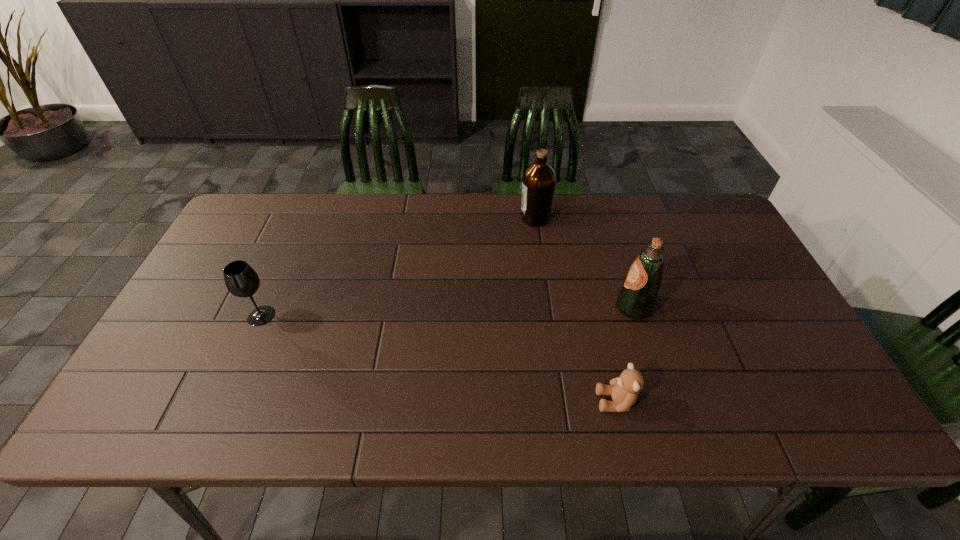
Locate an element on the screen. free space at the far edge of the desktop is located at coordinates (377, 207).

What are the coordinates of `free spot at the near edge of the desktop` in the screenshot? It's located at (711, 406).

I want to click on free region at the right edge of the desktop, so click(x=708, y=269).

Where is `vacant space at the far left corner of the desktop`? vacant space at the far left corner of the desktop is located at coordinates (275, 210).

Locate an element on the screen. The width and height of the screenshot is (960, 540). free region at the near left corner of the desktop is located at coordinates (154, 424).

In the image, there is a desktop. In order to click on free space at the far right corner in this screenshot , I will do `click(682, 233)`.

You are a GUI agent. You are given a task and a screenshot of the screen. Output one action in this format:
    pyautogui.click(x=<x>, y=<y>)
    Task: Click on the free spot at the near right corner of the desktop
    
    Given the screenshot: What is the action you would take?
    pyautogui.click(x=823, y=429)

Where is `unoccupied area between the farther olive oil and the teddy bear`? The width and height of the screenshot is (960, 540). unoccupied area between the farther olive oil and the teddy bear is located at coordinates (575, 310).

Identify the location of free space between the shortest object and the nearer olive oil. (625, 355).

Find the location of `vacant area that lies between the third object from right to left and the right olive oil`. vacant area that lies between the third object from right to left and the right olive oil is located at coordinates [584, 263].